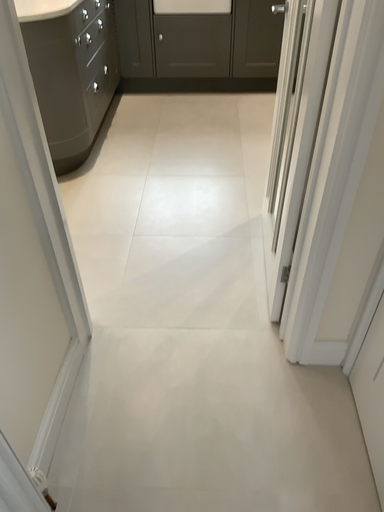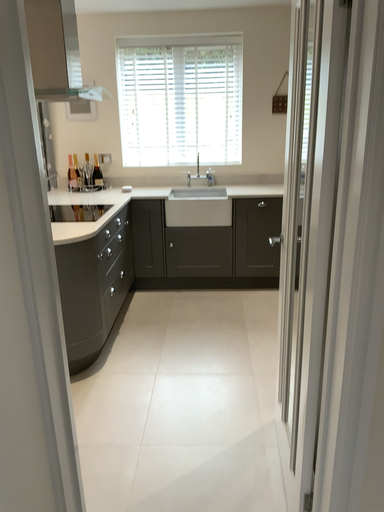
Question: How did the camera likely rotate when shooting the video?

Choices:
 (A) rotated upward
 (B) rotated downward

Answer: (A)